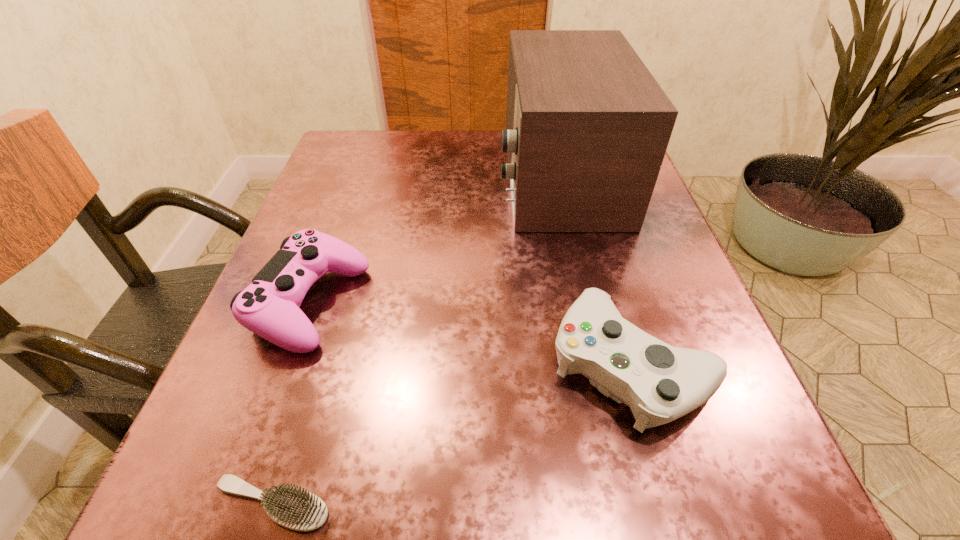
This screenshot has height=540, width=960. In order to click on the farthest object in this screenshot , I will do `click(587, 125)`.

In order to click on radio receiver in this screenshot , I will do `click(587, 125)`.

Where is `the left control`? Image resolution: width=960 pixels, height=540 pixels. the left control is located at coordinates (269, 307).

The width and height of the screenshot is (960, 540). What are the coordinates of `the right control` in the screenshot? It's located at (660, 383).

Locate an element on the screen. the nearest object is located at coordinates (297, 509).

Identify the location of the shortest object. (297, 509).

Locate an element on the screen. This screenshot has height=540, width=960. free space located 0.290m on the front-facing side of the farthest object is located at coordinates (365, 176).

I want to click on vacant space located 0.360m on the front-facing side of the farthest object, so click(x=333, y=176).

What are the coordinates of `vacant space located 0.140m on the front-facing side of the farthest object` in the screenshot? It's located at (433, 176).

What are the coordinates of `vacant region located 0.070m on the front of the left control` in the screenshot? It's located at (275, 402).